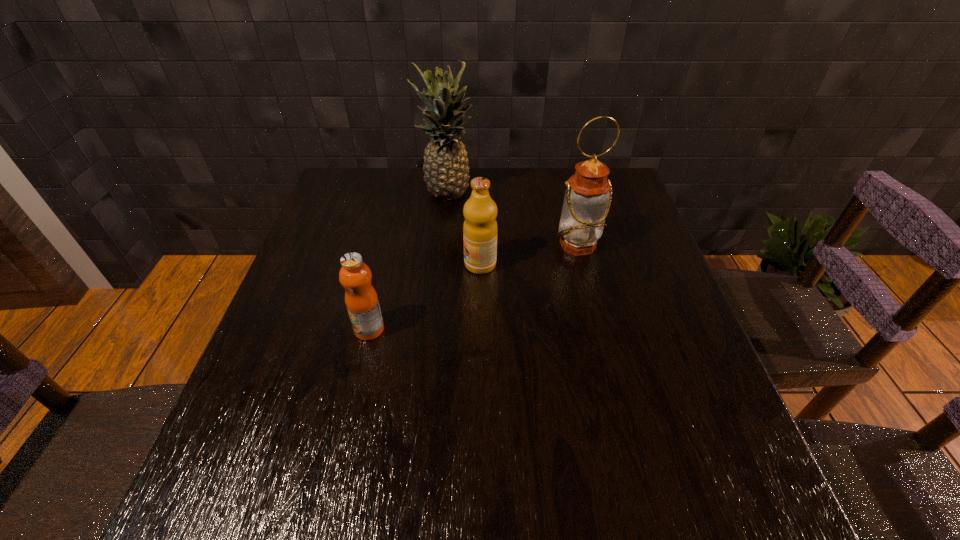
At what (x,y) coordinates should I click in order to perform the action: click on the farthest object. Please return your answer as a coordinate pair (x, y). The height and width of the screenshot is (540, 960). Looking at the image, I should click on (446, 171).

At what (x,y) coordinates should I click in order to perform the action: click on oil lamp. Please return your answer as a coordinate pair (x, y). Looking at the image, I should click on (588, 194).

This screenshot has height=540, width=960. Identify the location of the farther fruit juice. [480, 229].

Find the location of `the shortest object`. the shortest object is located at coordinates (361, 299).

The height and width of the screenshot is (540, 960). What are the coordinates of `the left fruit juice` in the screenshot? It's located at [361, 299].

The height and width of the screenshot is (540, 960). I want to click on vacant space located on the front of the farthest object, so click(442, 245).

Identify the location of free space located 0.320m on the back of the rightmost object. Image resolution: width=960 pixels, height=540 pixels. (560, 171).

Identify the location of vacant space located on the front label of the right fruit juice. (315, 265).

Image resolution: width=960 pixels, height=540 pixels. Find the location of `vacant space located on the front label of the right fruit juice`. vacant space located on the front label of the right fruit juice is located at coordinates (409, 265).

Locate an element on the screen. This screenshot has width=960, height=540. free location located on the front label of the right fruit juice is located at coordinates (354, 265).